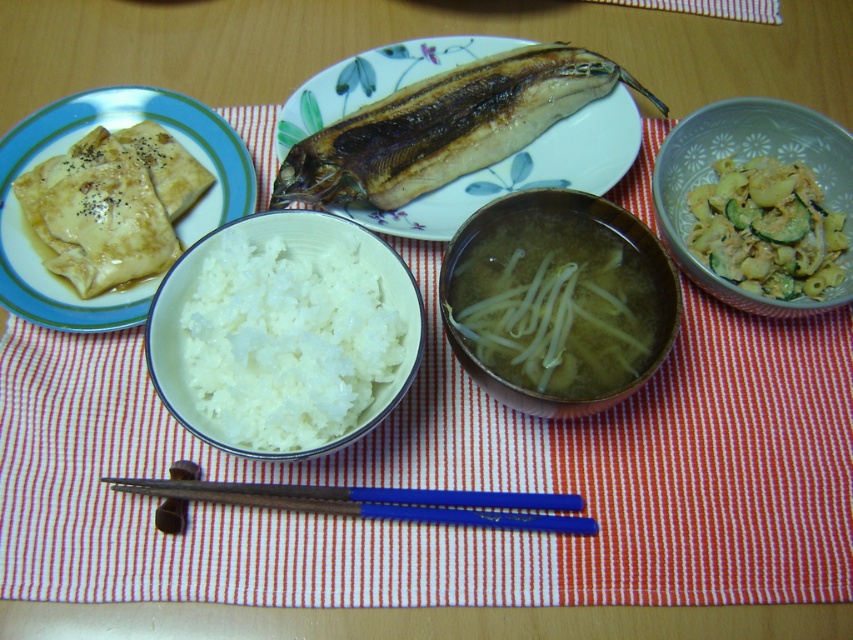
You are a food critic sitting at the wooden table and want to reach for the translucent glass bowl at center. Based on its 2D coordinates, can you estimate its position relative to the edge of the table?

The translucent glass bowl at center is located at coordinates approximately 47.2 cm from the left edge and 65.5 cm from the bottom edge of the table.

You are a food critic evaluating portion sizes for a review. You have to compare the size of the grilled brown fish at center and the matte brown crepes at left. Which one is bigger?

The grilled brown fish at center has a smaller size compared to matte brown crepes at left, so the matte brown crepes at left are bigger.

You are a guest at a dinner party and want to reach for the matte brown crepes at left. Which direction should you move your hand relative to the translucent glass bowl at center?

The translucent glass bowl at center is to the right of the matte brown crepes at left, so you should move your hand to the left of the translucent glass bowl at center to reach the matte brown crepes at left.